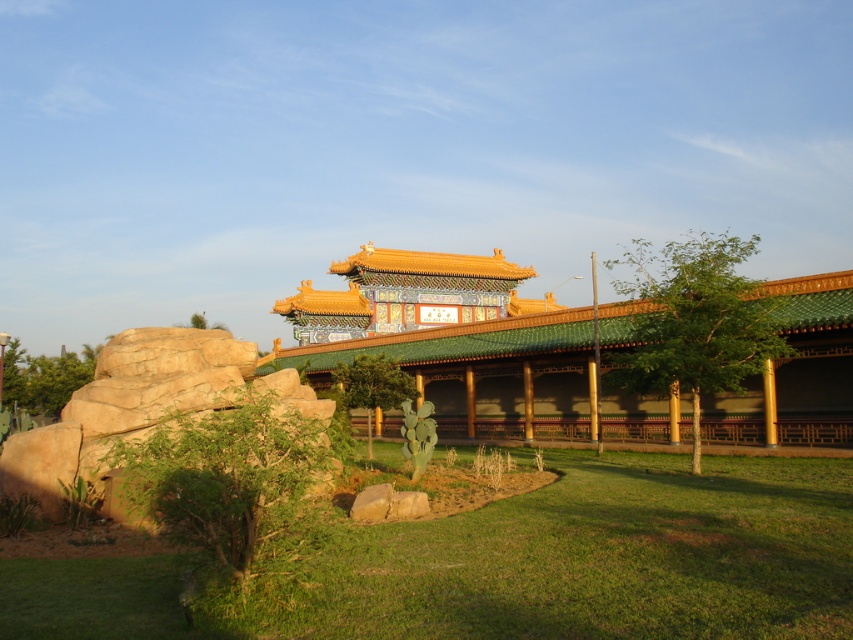
Question: Does green glazed tile palace at center appear under green leafy tree at upper center?

Choices:
 (A) yes
 (B) no

Answer: (B)

Question: Which of these objects is positioned farthest from the green glazed tile palace at center?

Choices:
 (A) green leafy tree at lower left
 (B) green grass at lower center
 (C) green leafy tree at upper center
 (D) green leafy tree at center-right

Answer: (C)

Question: Based on their relative distances, which object is nearer to the green leafy tree at lower left?

Choices:
 (A) green leafy tree at center-right
 (B) green leafy tree at left
 (C) green glazed tile palace at center
 (D) green grass at lower center

Answer: (D)

Question: Is green leafy tree at lower left smaller than green leafy tree at upper center?

Choices:
 (A) no
 (B) yes

Answer: (B)

Question: Does green leafy tree at lower left appear over green leafy tree at upper center?

Choices:
 (A) no
 (B) yes

Answer: (A)

Question: Among these objects, which one is nearest to the camera?

Choices:
 (A) green leafy tree at center
 (B) brown rough rock at left

Answer: (B)